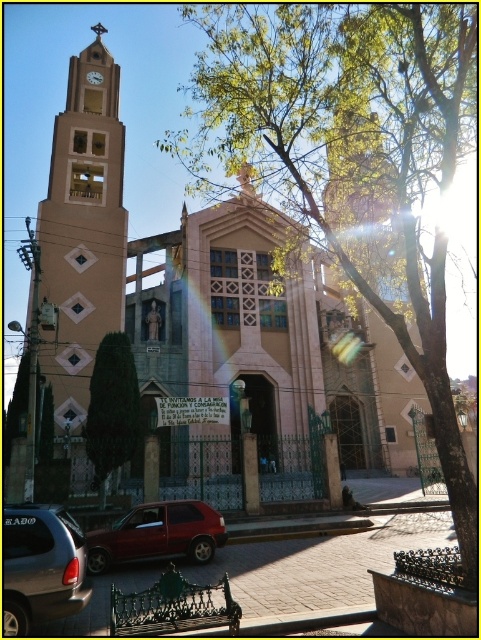
Question: Which of the following is the farthest from the observer?

Choices:
 (A) (85, 204)
 (B) (102, 76)

Answer: (B)

Question: Estimate the real-world distances between objects in this image. Which object is farther from the metallic red car at lower left?

Choices:
 (A) silver metallic suv at lower left
 (B) white glossy clock at upper left
 (C) green leafy tree at upper center
 (D) light beige stone bell tower at left

Answer: (B)

Question: Which of the following is the farthest from the observer?

Choices:
 (A) (455, 118)
 (B) (103, 99)
 (C) (95, 83)

Answer: (C)

Question: Does light beige stone bell tower at left appear on the left side of silver metallic suv at lower left?

Choices:
 (A) yes
 (B) no

Answer: (A)

Question: Is light beige stone bell tower at left to the right of silver metallic suv at lower left from the viewer's perspective?

Choices:
 (A) yes
 (B) no

Answer: (B)

Question: Does light beige stone bell tower at left appear under metallic red car at lower left?

Choices:
 (A) yes
 (B) no

Answer: (B)